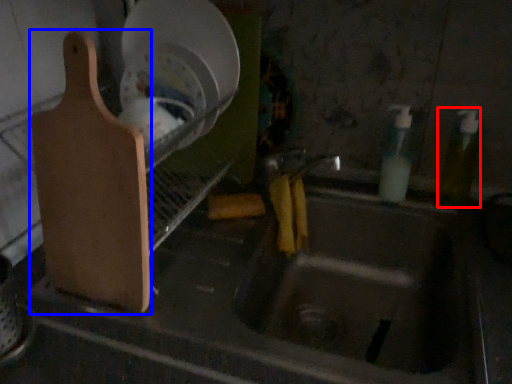
Question: Which of the following is the closest to the observer, bottle (highlighted by a red box) or cutting board (highlighted by a blue box)?

Choices:
 (A) bottle
 (B) cutting board

Answer: (B)